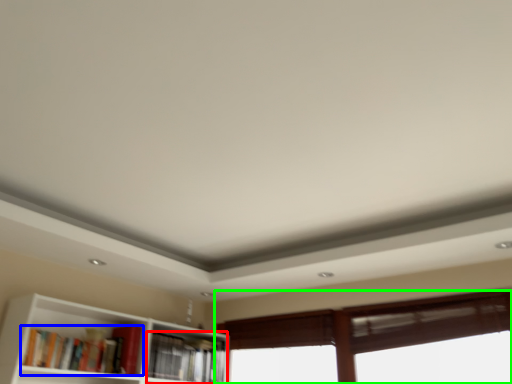
Question: Estimate the real-world distances between objects in this image. Which object is farther from book (highlighted by a red box), book (highlighted by a blue box) or window (highlighted by a green box)?

Choices:
 (A) book
 (B) window

Answer: (B)